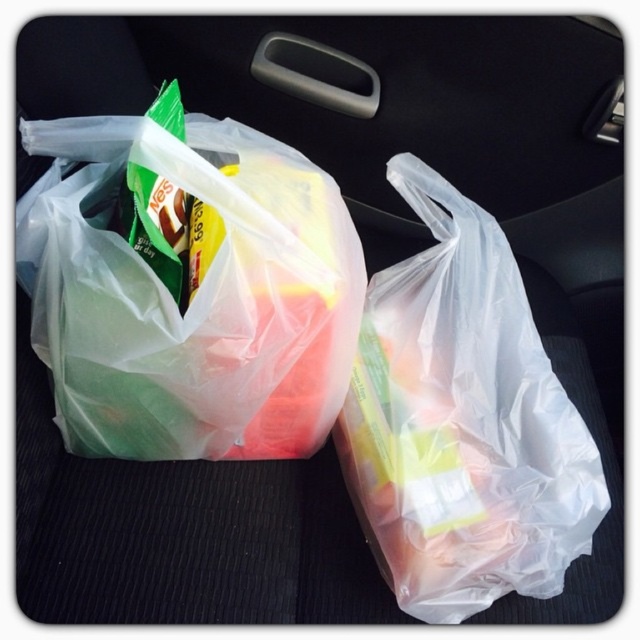
Between translucent plastic bag at left and transparent plastic bag at center, which one is positioned lower?

Positioned lower is transparent plastic bag at center.

Does translucent plastic bag at left appear over transparent plastic bag at center?

Yes, translucent plastic bag at left is above transparent plastic bag at center.

This screenshot has height=640, width=640. What do you see at coordinates (193, 294) in the screenshot?
I see `translucent plastic bag at left` at bounding box center [193, 294].

Identify the location of translucent plastic bag at left. This screenshot has width=640, height=640. (193, 294).